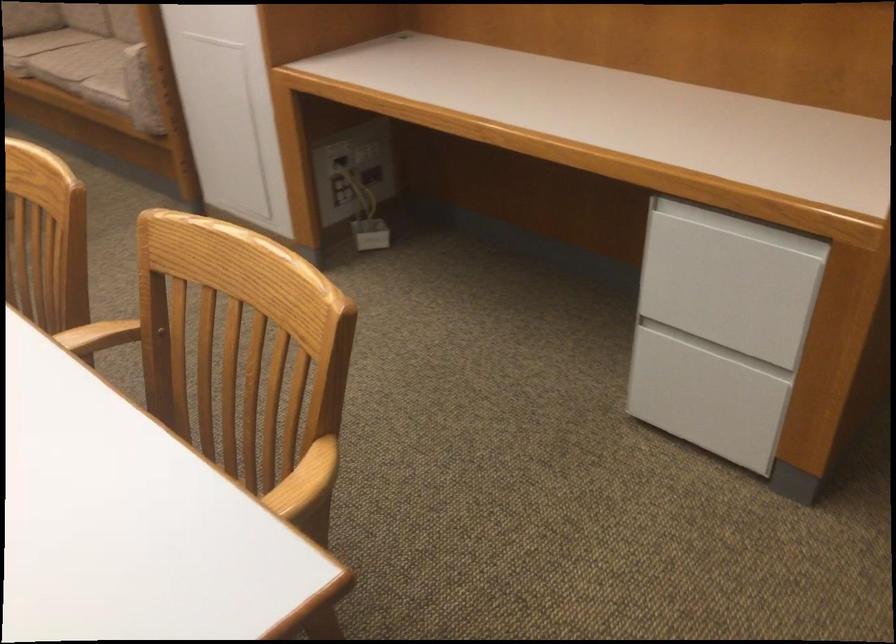
What do you see at coordinates (140, 26) in the screenshot? I see `the sofa armrest` at bounding box center [140, 26].